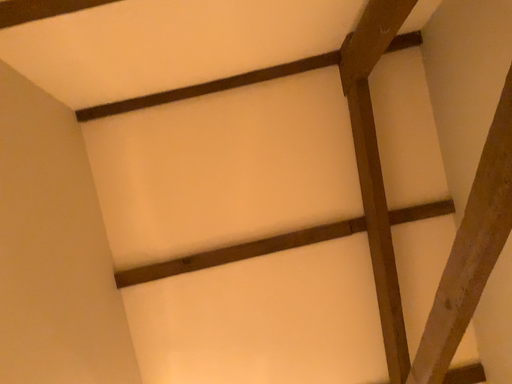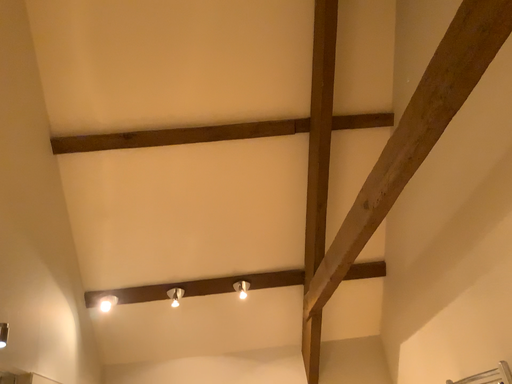
Question: Which way did the camera rotate in the video?

Choices:
 (A) rotated right
 (B) rotated left

Answer: (A)